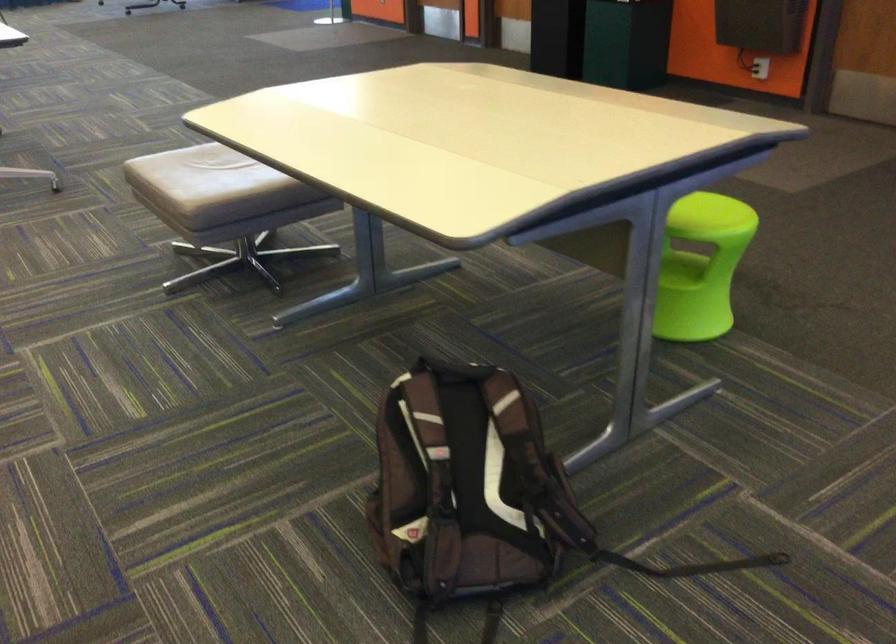
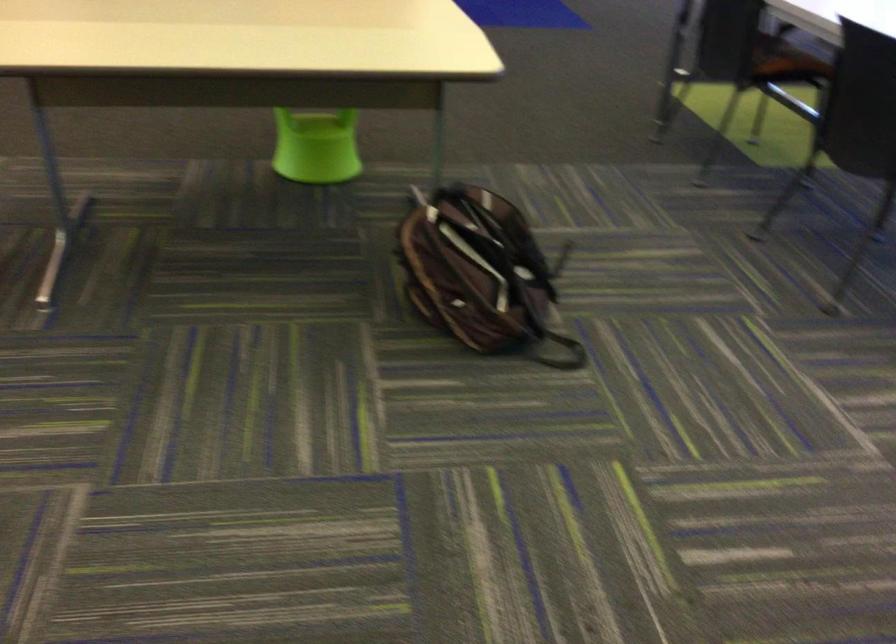
The point at (421, 478) is marked in the first image. Where is the corresponding point in the second image?

(479, 272)